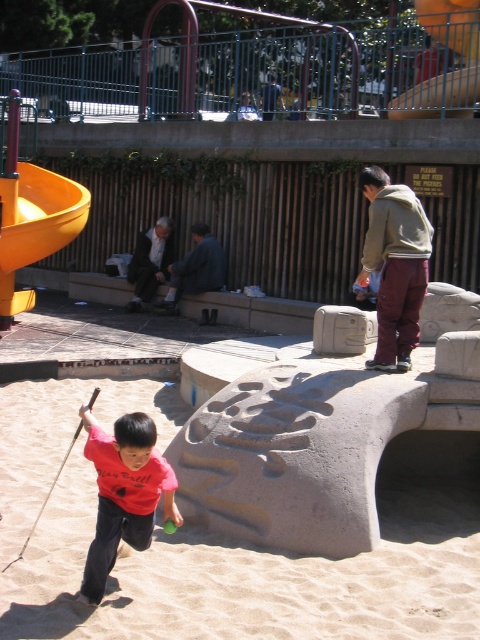
Question: Which point is farther from the camera taking this photo?

Choices:
 (A) (450, 96)
 (B) (166, 465)
 (C) (194, 291)
 (D) (44, 604)

Answer: (C)

Question: Is the position of smooth sand at lower left more distant than that of yellow plastic slide at upper center?

Choices:
 (A) yes
 (B) no

Answer: (B)

Question: Which of these objects is positioned farthest from the yellow plastic slide at left?

Choices:
 (A) maroon fleece pants at right
 (B) blue jeans at center

Answer: (A)

Question: Is red cotton shirt at lower left further to camera compared to yellow plastic slide at left?

Choices:
 (A) no
 (B) yes

Answer: (A)

Question: Can you confirm if red cotton shirt at lower left is positioned to the right of blue denim jacket at center?

Choices:
 (A) yes
 (B) no

Answer: (B)

Question: Which point is farther to the camera?

Choices:
 (A) (405, 193)
 (B) (132, 390)
 (C) (142, 278)

Answer: (C)